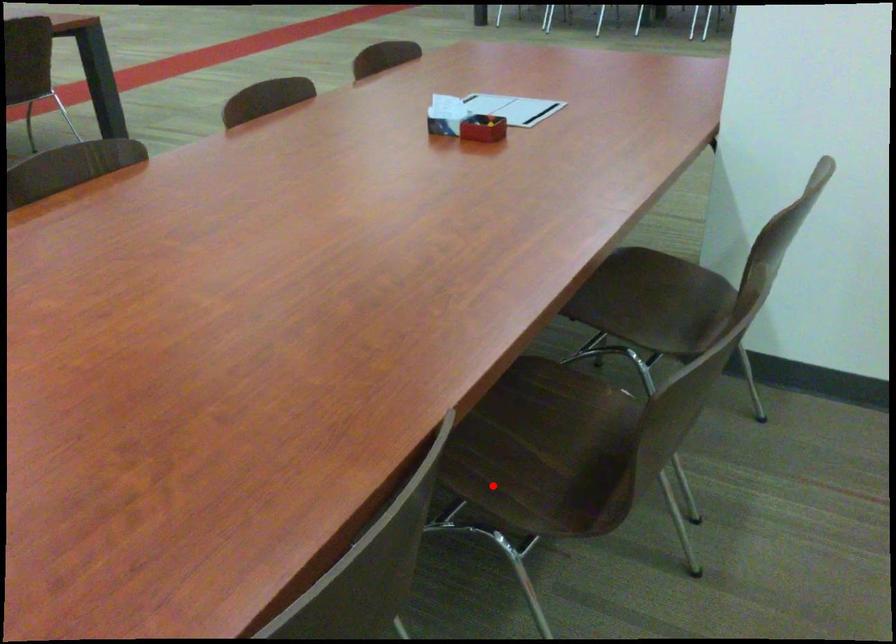
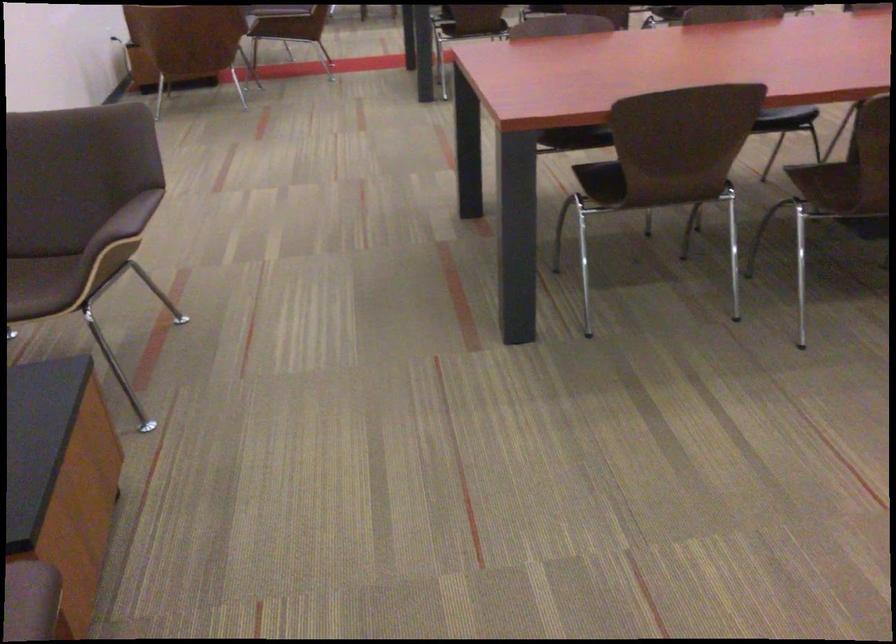
Question: A red point is marked in image1. In image2, is the corresponding 3D point closer to the camera or farther? Reply with the corresponding letter.

Choices:
 (A) The corresponding 3D point is closer.
 (B) The corresponding 3D point is farther.

Answer: (B)